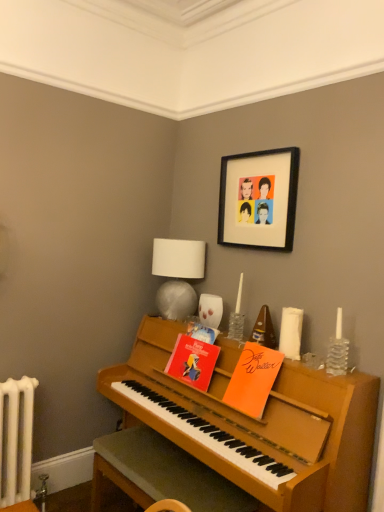
Question: From the image's perspective, would you say white fabric lampshade at upper center is positioned over clear glass candle at right?

Choices:
 (A) no
 (B) yes

Answer: (B)

Question: Can you confirm if white fabric lampshade at upper center is thinner than clear glass candle at right?

Choices:
 (A) yes
 (B) no

Answer: (B)

Question: Does white fabric lampshade at upper center have a smaller size compared to clear glass candle at right?

Choices:
 (A) yes
 (B) no

Answer: (B)

Question: Is white fabric lampshade at upper center positioned beyond the bounds of clear glass candle at right?

Choices:
 (A) no
 (B) yes

Answer: (B)

Question: Is white fabric lampshade at upper center to the left of clear glass candle at right from the viewer's perspective?

Choices:
 (A) no
 (B) yes

Answer: (B)

Question: Can you confirm if white fabric lampshade at upper center is shorter than clear glass candle at right?

Choices:
 (A) yes
 (B) no

Answer: (B)

Question: From a real-world perspective, is clear glass candle at right below red paper book at center, positioned as the first book in left-to-right order?

Choices:
 (A) yes
 (B) no

Answer: (B)

Question: From a real-world perspective, is clear glass candle at right over red paper book at center, positioned as the first book in left-to-right order?

Choices:
 (A) yes
 (B) no

Answer: (A)

Question: Is clear glass candle at right at the left side of red paper book at center, the third book viewed from the right?

Choices:
 (A) yes
 (B) no

Answer: (B)

Question: Is clear glass candle at right wider than red paper book at center, positioned as the first book in left-to-right order?

Choices:
 (A) yes
 (B) no

Answer: (B)

Question: Would you say red paper book at center, positioned as the first book in left-to-right order, is part of clear glass candle at right's contents?

Choices:
 (A) yes
 (B) no

Answer: (B)

Question: Is clear glass candle at right further to the viewer compared to red paper book at center, positioned as the first book in left-to-right order?

Choices:
 (A) no
 (B) yes

Answer: (A)

Question: Are white fabric lampshade at upper center and black matte picture frame at upper center beside each other?

Choices:
 (A) no
 (B) yes

Answer: (A)